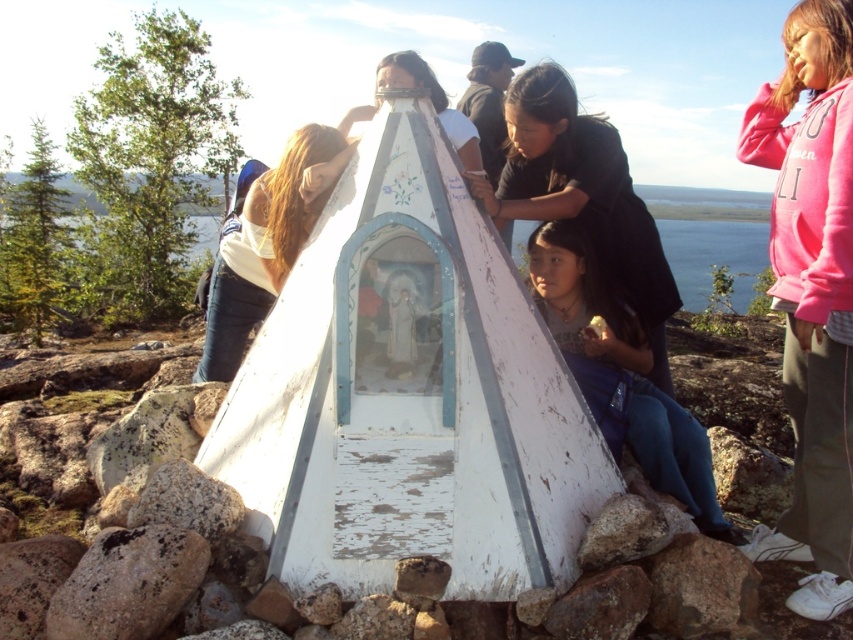
Can you confirm if speckled granite rock at lower left is positioned to the right of brown rough rock at lower right?

In fact, speckled granite rock at lower left is to the left of brown rough rock at lower right.

Does speckled granite rock at lower left have a greater height compared to brown rough rock at lower right?

Indeed, speckled granite rock at lower left has a greater height compared to brown rough rock at lower right.

Which is in front, point (144, 600) or point (698, 577)?

Point (144, 600) is in front.

You are a GUI agent. You are given a task and a screenshot of the screen. Output one action in this format:
    pyautogui.click(x=<x>, y=<y>)
    Task: Click on the speckled granite rock at lower left
    
    Given the screenshot: What is the action you would take?
    pyautogui.click(x=128, y=582)

Who is higher up, matte white shirt at left or speckled granite rock at lower left?

matte white shirt at left is above.

Which of these two, matte white shirt at left or speckled granite rock at lower left, stands shorter?

Standing shorter between the two is speckled granite rock at lower left.

Which is behind, point (285, 227) or point (111, 637)?

The point (285, 227) is behind.

Where is `matte white shirt at left`? matte white shirt at left is located at coordinates (260, 248).

Can you confirm if pink fleece jacket at upper right is positioned to the left of speckled granite rock at lower left?

Incorrect, pink fleece jacket at upper right is not on the left side of speckled granite rock at lower left.

Between point (851, 74) and point (109, 552), which one is positioned behind?

Point (851, 74)

This screenshot has height=640, width=853. Identify the location of pink fleece jacket at upper right. (811, 292).